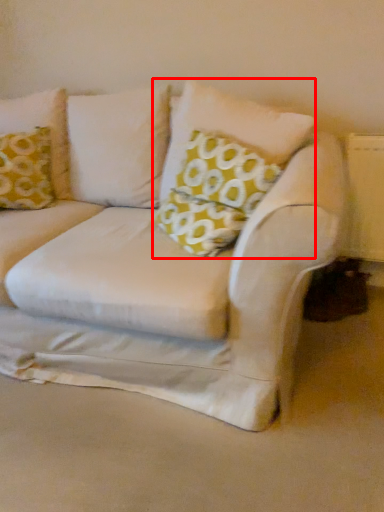
Question: From the image's perspective, where is pillow (annotated by the red box) located relative to pillow?

Choices:
 (A) below
 (B) above

Answer: (A)